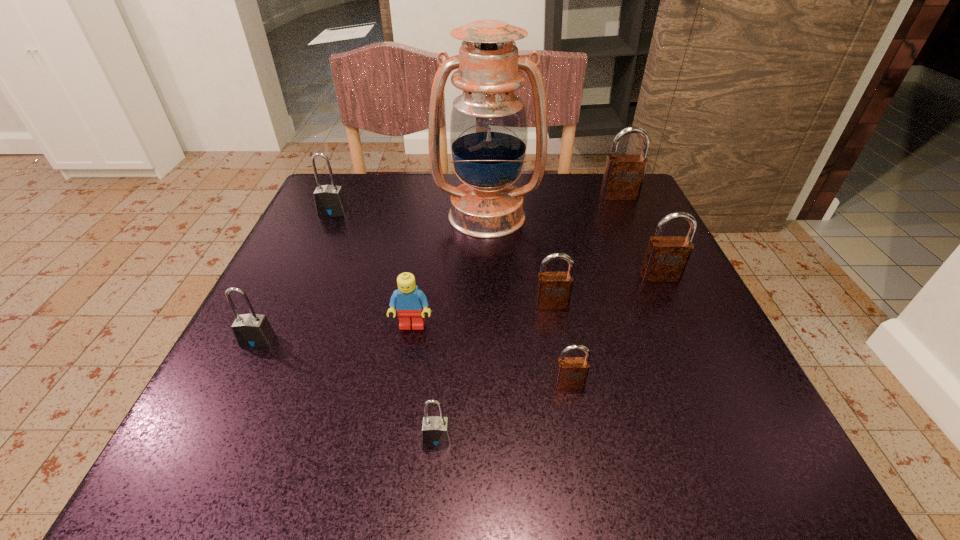
I want to click on vacant area in the image that satisfies the following two spatial constraints: 1. on the shackle of the blue oil lamp; 2. on the left side of the second farthest padlock, so click(331, 215).